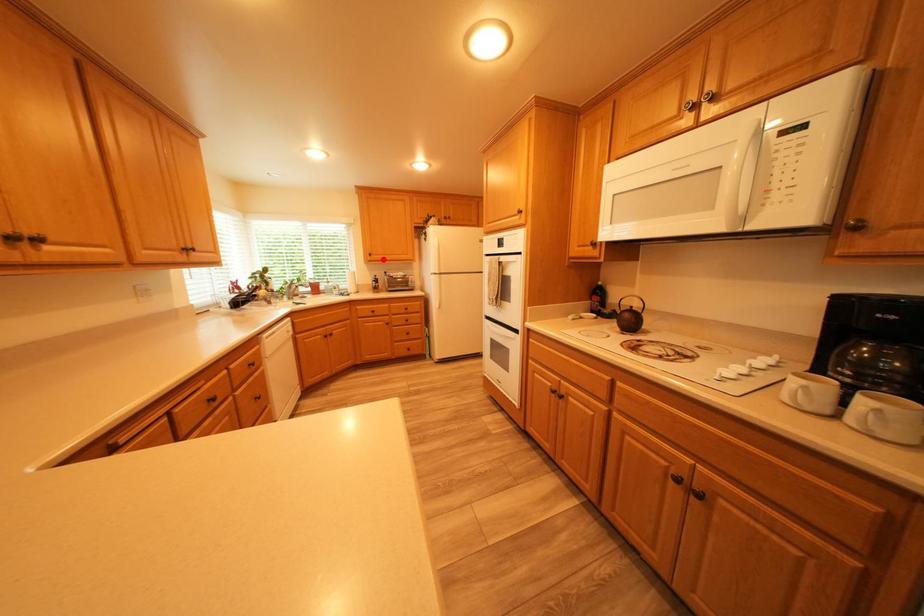
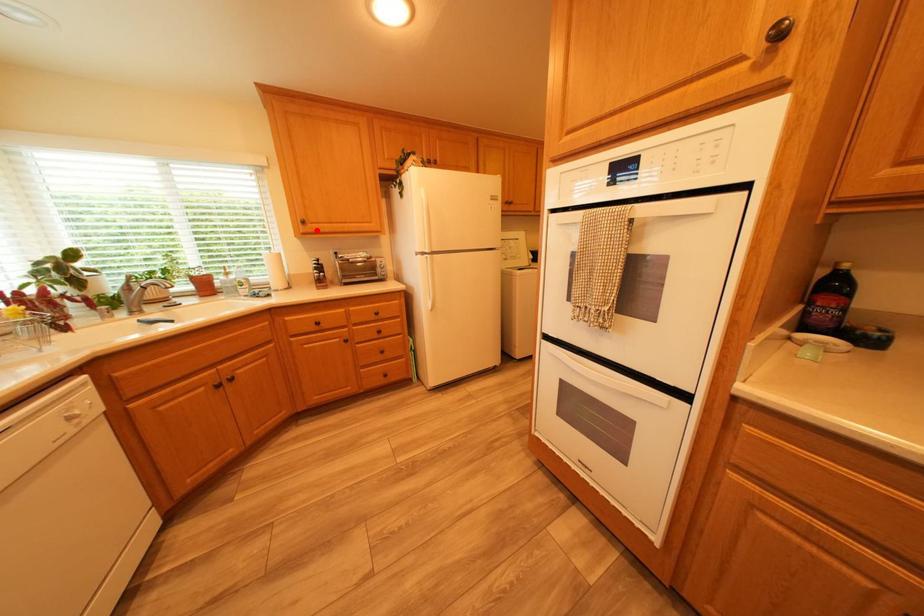
I am providing you with two images of the same scene from different viewpoints. A red point is marked on the first image and another point is marked on the second image. Is the marked point in image1 the same physical position as the marked point in image2?

Yes